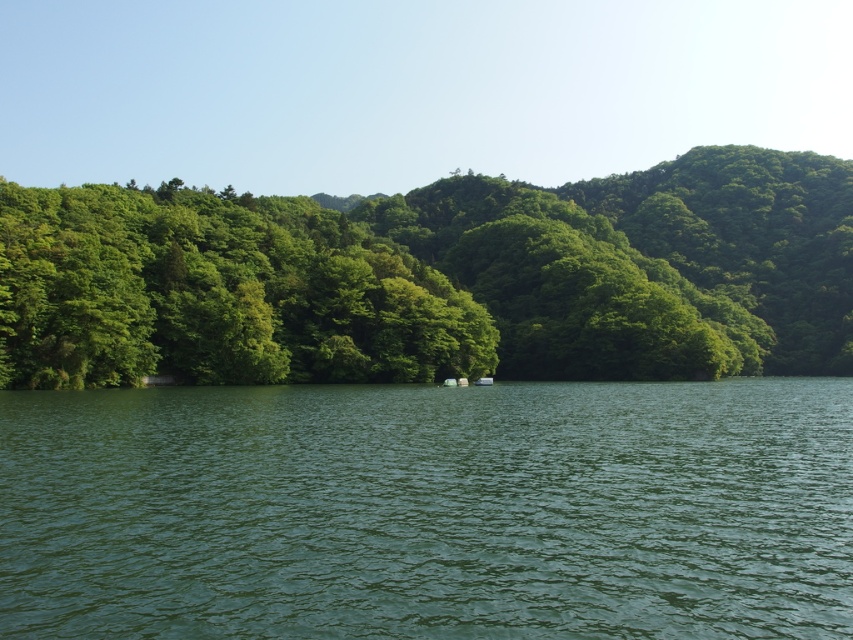
Who is shorter, green liquid water at center or green leafy trees at left?

green liquid water at center is shorter.

Between green liquid water at center and green leafy trees at left, which one appears on the left side from the viewer's perspective?

From the viewer's perspective, green liquid water at center appears more on the left side.

Locate an element on the screen. The image size is (853, 640). green liquid water at center is located at coordinates (428, 509).

This screenshot has height=640, width=853. I want to click on green liquid water at center, so click(x=428, y=509).